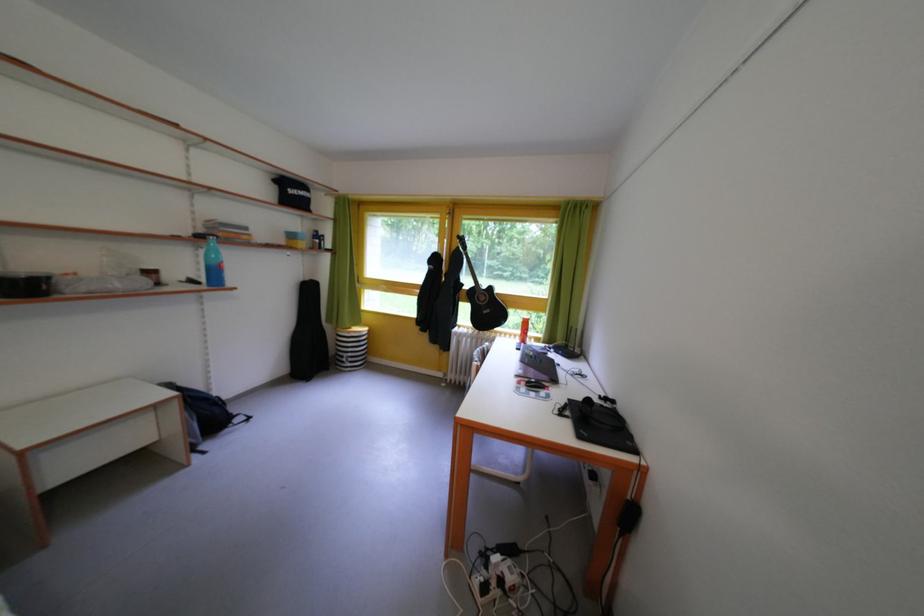
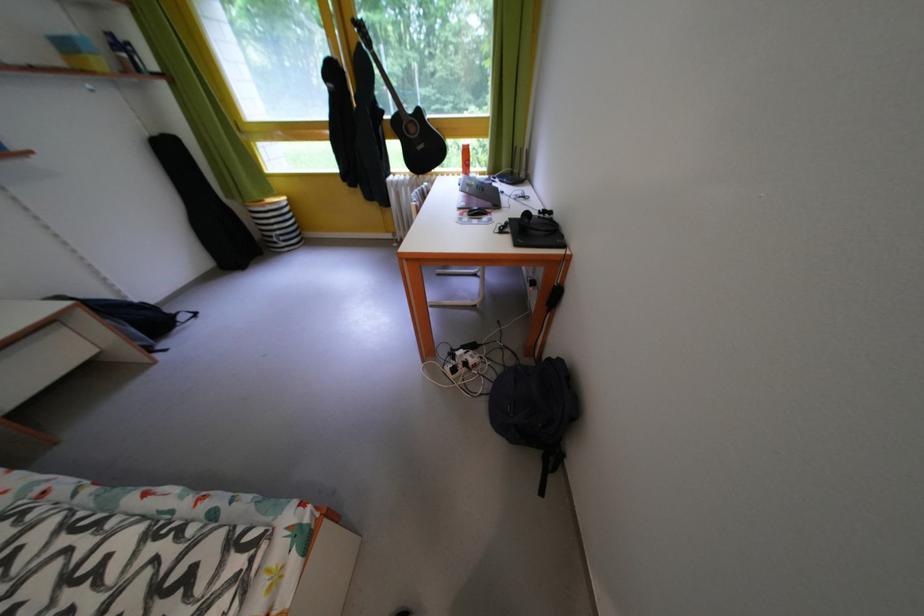
Where in the second image is the point corresponding to (359,360) from the first image?

(287, 238)